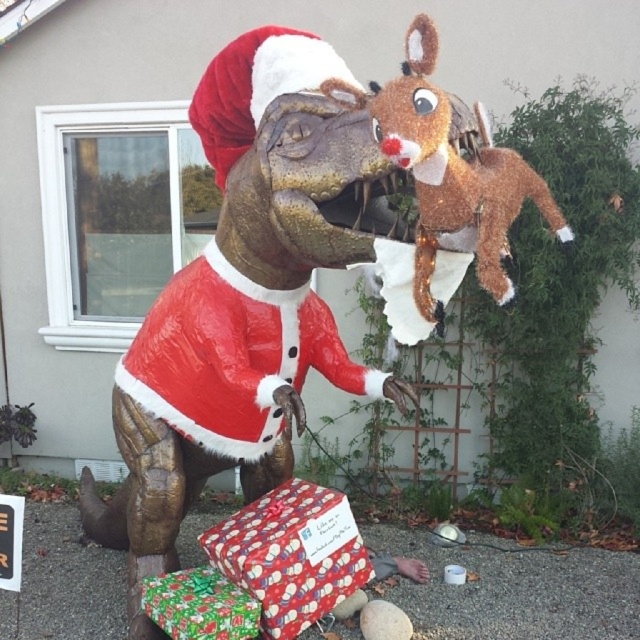
You are a child trying to find the shiny paper gift at lower center. The fuzzy brown reindeer at upper right is in your way. Can you move the reindeer to access the gift?

The fuzzy brown reindeer at upper right is located above the shiny paper gift at lower center, so you can move the reindeer downward to access the gift.

You are a child who wants to choose the wider gift between the wrapping paper gift at lower center and the shiny paper gift at lower center. Based on the scene, which one is wider?

The wrapping paper gift at lower center might be wider than the shiny paper gift at lower center according to the scene description.